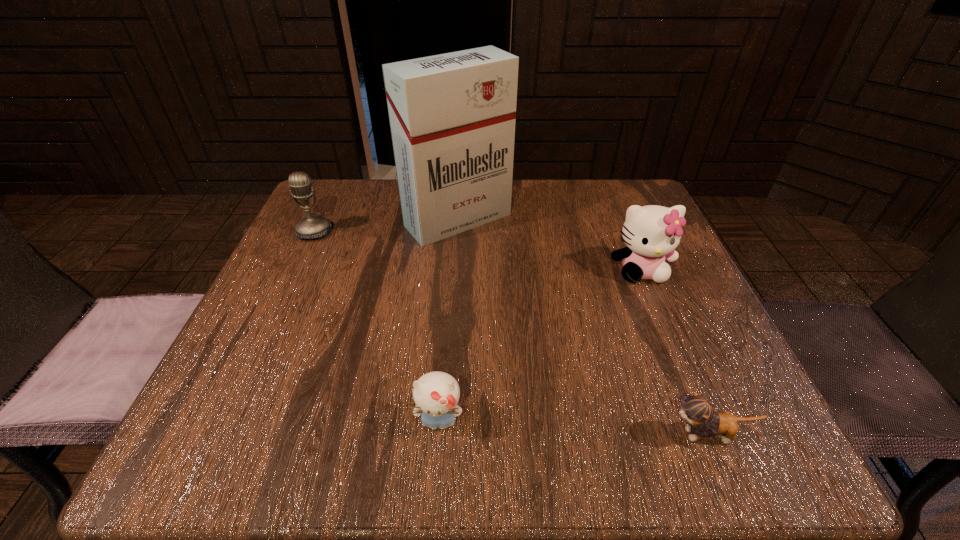
I want to click on free location at the left edge, so [x=263, y=292].

You are a GUI agent. You are given a task and a screenshot of the screen. Output one action in this format:
    pyautogui.click(x=<x>, y=<y>)
    Task: Click on the vacant space at the right edge
    
    Given the screenshot: What is the action you would take?
    pyautogui.click(x=703, y=391)

This screenshot has height=540, width=960. What are the coordinates of `blank space at the far left corner of the desktop` in the screenshot? It's located at (350, 194).

This screenshot has height=540, width=960. I want to click on vacant space at the near left corner, so click(x=233, y=435).

This screenshot has width=960, height=540. Identify the location of vacant space at the far right corner. (579, 183).

The width and height of the screenshot is (960, 540). I want to click on empty space between the tallest kitten and the leftmost object, so coord(477,251).

At what (x,y) coordinates should I click in order to perform the action: click on free space between the tallest kitten and the microphone. Please return your answer as a coordinate pair (x, y). Looking at the image, I should click on (477, 251).

Image resolution: width=960 pixels, height=540 pixels. I want to click on vacant area that lies between the tallest object and the third nearest object, so (549, 245).

The image size is (960, 540). I want to click on free space that is in between the cigarette case and the tallest kitten, so click(549, 245).

Image resolution: width=960 pixels, height=540 pixels. Find the location of `free space that is in between the third farthest object and the microphone`. free space that is in between the third farthest object and the microphone is located at coordinates (477, 251).